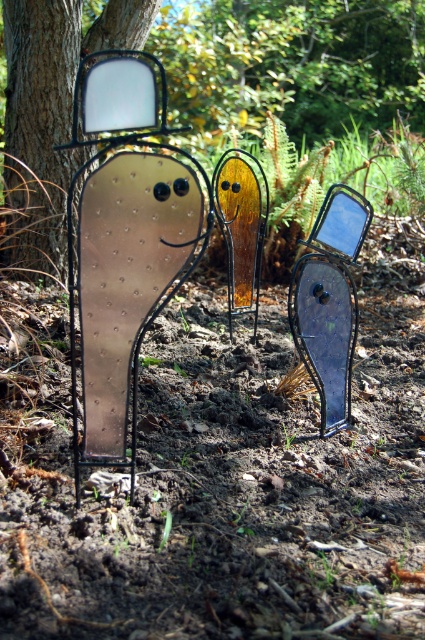
You are an artist planning to paint this scene. You need to decide which object to focus on first based on their sizes. Which object should you paint first, the brushed metal tree at upper center or the brushed metal mirror at left?

The brushed metal tree at upper center is larger in size than the brushed metal mirror at left, so you should paint the brushed metal tree at upper center first as it requires more attention due to its larger size.

You are a maintenance worker who needs to clean both the brushed metal tree at upper center and the brushed metal mirror at left. You have a 2.5 meter long pole. Can you reach the mirror from the tree without moving the pole?

The distance between the brushed metal tree at upper center and the brushed metal mirror at left is 2.29 meters. Since the pole is 2.5 meters long, which is longer than the distance between them, you can reach the mirror from the tree without moving the pole.

From the picture: You are an artist planning to paint this scene. You want to ensure that the perspective of the objects aligns with their actual positions. Which object should appear closer to you in your painting, the brushed metal tree at upper center or the brushed metal mirror at left?

The brushed metal tree at upper center should appear closer in the painting because it is further to the viewer than the brushed metal mirror at left according to the description.